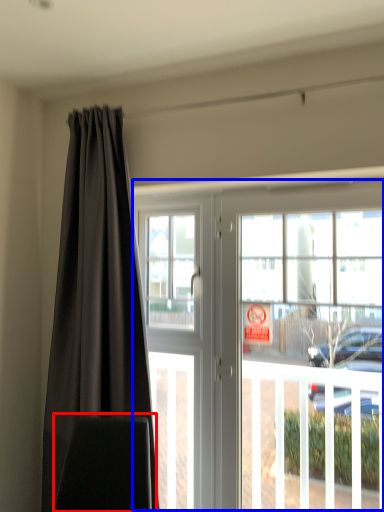
Question: Which point is further to the camera, swivel chair (highlighted by a red box) or door (highlighted by a blue box)?

Choices:
 (A) swivel chair
 (B) door

Answer: (B)